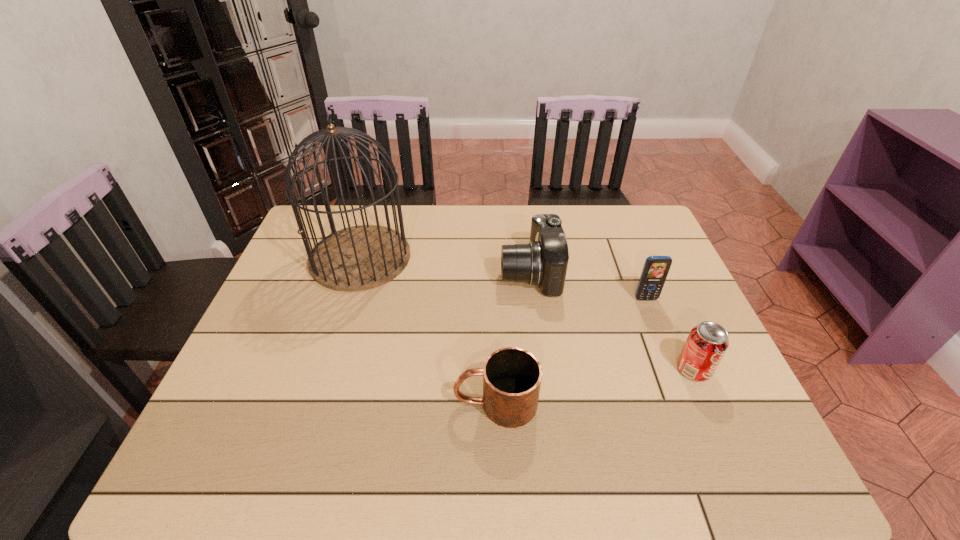
Where is `free space between the cellular telephone and the mug`? This screenshot has width=960, height=540. free space between the cellular telephone and the mug is located at coordinates (570, 351).

This screenshot has height=540, width=960. Find the location of `unoccupied area between the soda can and the mug`. unoccupied area between the soda can and the mug is located at coordinates (594, 386).

Image resolution: width=960 pixels, height=540 pixels. In order to click on vacant space that is in between the mug and the cellular telephone in this screenshot , I will do `click(570, 351)`.

Locate an element on the screen. object that is the third closest to the camera is located at coordinates (358, 258).

Find the location of a particular element. object that is the third nearest to the camera is located at coordinates (358, 258).

Identify the location of free spot that satisfies the following two spatial constraints: 1. on the lens of the camera; 2. on the right side of the soda can. The image size is (960, 540). (542, 369).

This screenshot has width=960, height=540. I want to click on blank area in the image that satisfies the following two spatial constraints: 1. on the screen of the cellular telephone; 2. on the side of the mug with the handle, so click(686, 403).

The height and width of the screenshot is (540, 960). I want to click on vacant space that satisfies the following two spatial constraints: 1. on the back side of the soda can; 2. on the lens of the camera, so click(x=652, y=272).

You are a GUI agent. You are given a task and a screenshot of the screen. Output one action in this format:
    pyautogui.click(x=<x>, y=<y>)
    Task: Click on the free space that satisfies the following two spatial constraints: 1. at the door of the soda can; 2. on the left side of the birdcage
    The height and width of the screenshot is (540, 960).
    Given the screenshot: What is the action you would take?
    pyautogui.click(x=324, y=369)